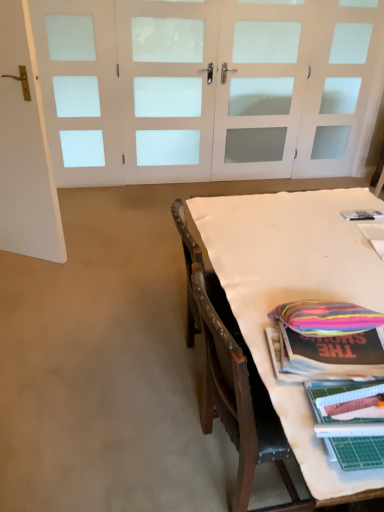
Question: Does white frosted glass door at upper center, which appears as the 1th door when viewed from the right, contain white matte door at left, the 1th door in the left-to-right sequence?

Choices:
 (A) yes
 (B) no

Answer: (B)

Question: From a real-world perspective, is white frosted glass door at upper center, the second door positioned from the left, on top of white matte door at left, the 1th door in the left-to-right sequence?

Choices:
 (A) no
 (B) yes

Answer: (B)

Question: Is white frosted glass door at upper center, the first door when ordered from back to front, far from white matte door at left, placed as the 2th door when sorted from right to left?

Choices:
 (A) yes
 (B) no

Answer: (A)

Question: Does white frosted glass door at upper center, the first door when ordered from back to front, lie in front of white matte door at left, the 1th door in the left-to-right sequence?

Choices:
 (A) yes
 (B) no

Answer: (B)

Question: Does white frosted glass door at upper center, the second door positioned from the left, have a smaller size compared to white matte door at left, placed as the 1th door when sorted from front to back?

Choices:
 (A) yes
 (B) no

Answer: (A)

Question: Is white frosted glass door at upper center, which is the second door from front to back, in contact with white matte door at left, placed as the 2th door when sorted from right to left?

Choices:
 (A) yes
 (B) no

Answer: (B)

Question: Does white matte door at left, placed as the 1th door when sorted from front to back, have a lesser width compared to white fabric-covered table at lower right?

Choices:
 (A) yes
 (B) no

Answer: (A)

Question: From a real-world perspective, is white matte door at left, placed as the 2th door when sorted from right to left, positioned under white fabric-covered table at lower right based on gravity?

Choices:
 (A) yes
 (B) no

Answer: (B)

Question: Considering the relative sizes of white matte door at left, positioned as the second door in back-to-front order, and white fabric-covered table at lower right in the image provided, is white matte door at left, positioned as the second door in back-to-front order, bigger than white fabric-covered table at lower right?

Choices:
 (A) yes
 (B) no

Answer: (B)

Question: Does white matte door at left, positioned as the second door in back-to-front order, appear on the right side of white fabric-covered table at lower right?

Choices:
 (A) no
 (B) yes

Answer: (A)

Question: From the image's perspective, is white matte door at left, placed as the 1th door when sorted from front to back, above white fabric-covered table at lower right?

Choices:
 (A) no
 (B) yes

Answer: (B)

Question: Is white fabric-covered table at lower right located within white matte door at left, placed as the 2th door when sorted from right to left?

Choices:
 (A) no
 (B) yes

Answer: (A)

Question: From a real-world perspective, is white frosted glass door at upper center, which is the second door from front to back, on white fabric-covered table at lower right?

Choices:
 (A) yes
 (B) no

Answer: (A)